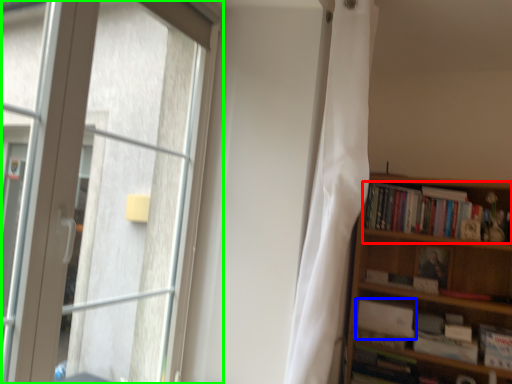
Question: Which object is positioned farthest from book (highlighted by a red box)? Select from book (highlighted by a blue box) and window (highlighted by a green box).

Choices:
 (A) book
 (B) window

Answer: (B)